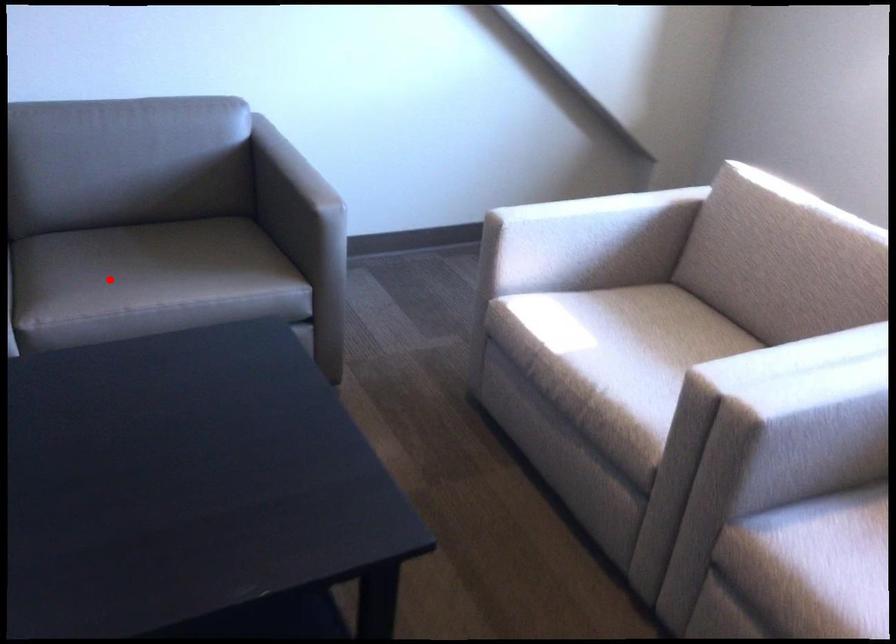
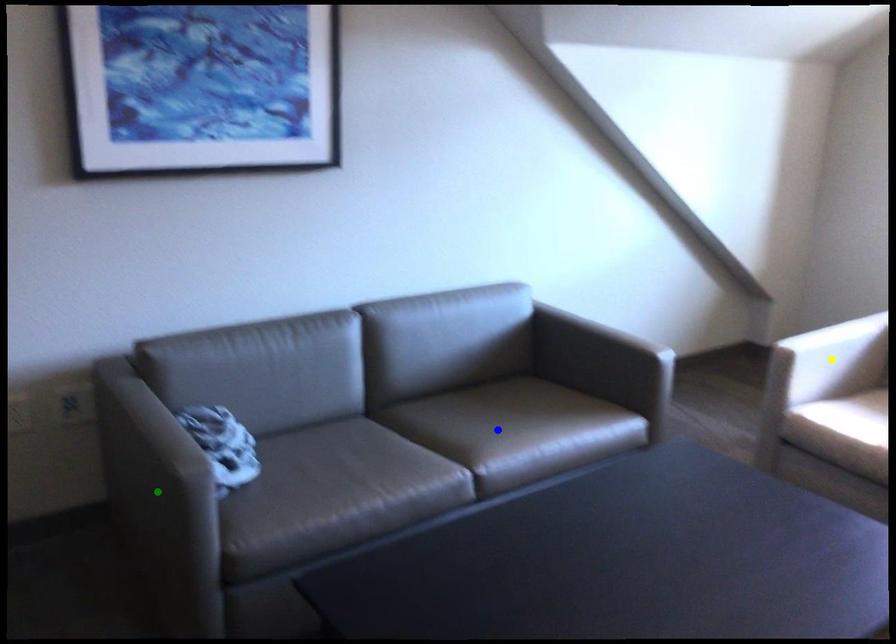
Question: I am providing you with two images of the same scene from different viewpoints. A red point is marked on the first image. You are given multiple points on the second image. Which point in image 2 represents the same 3d spot as the red point in image 1?

Choices:
 (A) yellow point
 (B) blue point
 (C) green point

Answer: (B)